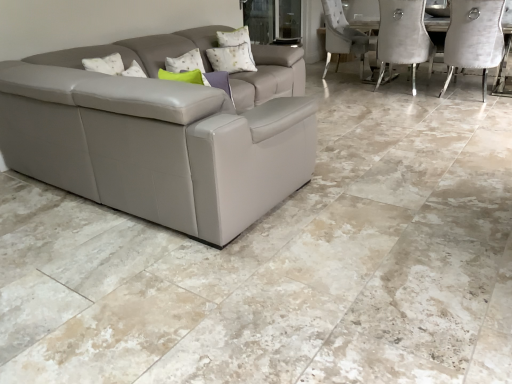
The width and height of the screenshot is (512, 384). What are the coordinates of `vacant space in velvet grey chair at upper right (from a real-world perspective)` in the screenshot? It's located at (463, 96).